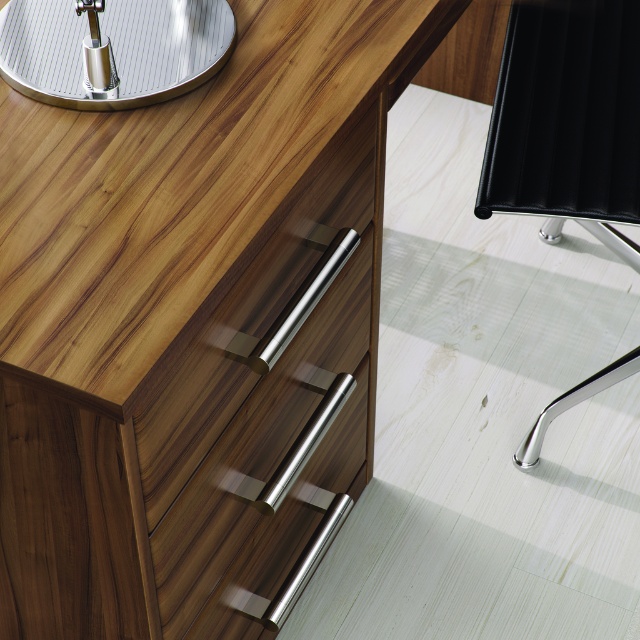
Can you confirm if wooden grain desk at upper left is thinner than polished silver table at upper left?

In fact, wooden grain desk at upper left might be wider than polished silver table at upper left.

This screenshot has height=640, width=640. I want to click on wooden grain desk at upper left, so click(x=189, y=323).

Can you confirm if black leather swivel chair at right is bigger than polished silver table at upper left?

Yes, black leather swivel chair at right is bigger than polished silver table at upper left.

Between point (552, 52) and point (22, 77), which one is positioned behind?

Point (552, 52)

Describe the element at coordinates (566, 120) in the screenshot. I see `black leather swivel chair at right` at that location.

Where is `black leather swivel chair at right`? The height and width of the screenshot is (640, 640). black leather swivel chair at right is located at coordinates (566, 120).

Can you confirm if wooden grain desk at upper left is positioned to the right of black leather swivel chair at right?

In fact, wooden grain desk at upper left is to the left of black leather swivel chair at right.

Is wooden grain desk at upper left above black leather swivel chair at right?

Incorrect, wooden grain desk at upper left is not positioned above black leather swivel chair at right.

Is point (26, 154) more distant than point (573, 168)?

That is False.

The image size is (640, 640). What are the coordinates of `wooden grain desk at upper left` in the screenshot? It's located at (189, 323).